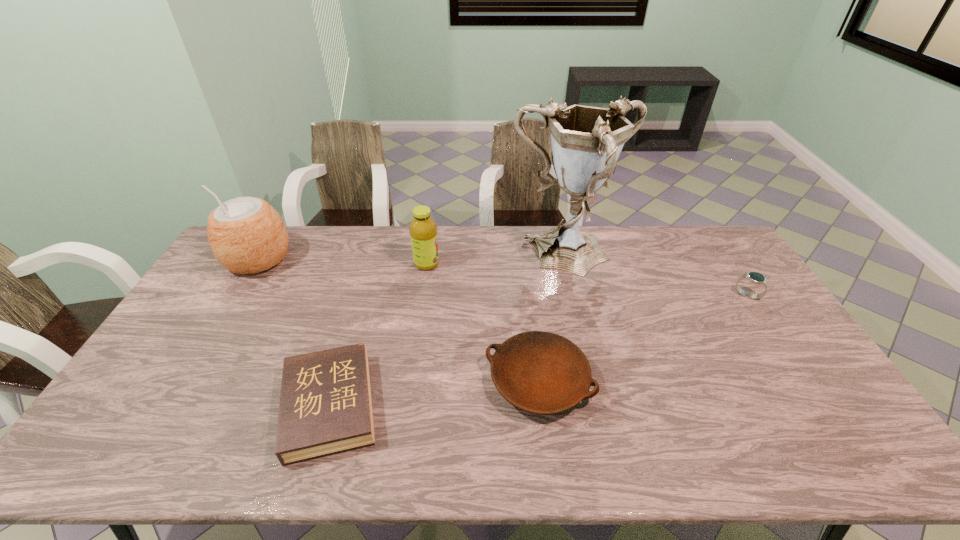
Identify the location of vacant space that satisfies the following two spatial constraints: 1. on the back side of the rightmost object; 2. on the front label of the third object from left to right. This screenshot has height=540, width=960. (726, 264).

Where is `vacant space that satisfies the following two spatial constraints: 1. on the front label of the plate; 2. on the left side of the fruit juice`? vacant space that satisfies the following two spatial constraints: 1. on the front label of the plate; 2. on the left side of the fruit juice is located at coordinates coord(410,381).

Where is `free space that satisfies the following two spatial constraints: 1. on the front label of the third tallest object; 2. on the right side of the rightmost object`? free space that satisfies the following two spatial constraints: 1. on the front label of the third tallest object; 2. on the right side of the rightmost object is located at coordinates (422, 295).